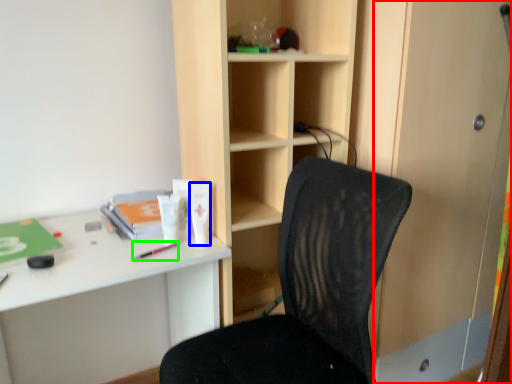
Question: Which is nearer to the screen door (highlighted by a red box)? stationery (highlighted by a blue box) or stationery (highlighted by a green box).

Choices:
 (A) stationery
 (B) stationery

Answer: (A)